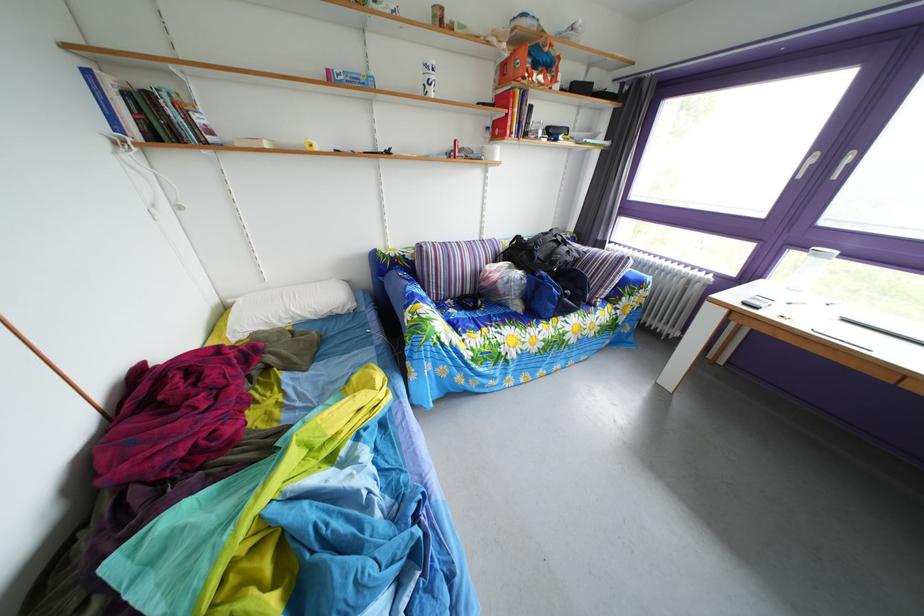
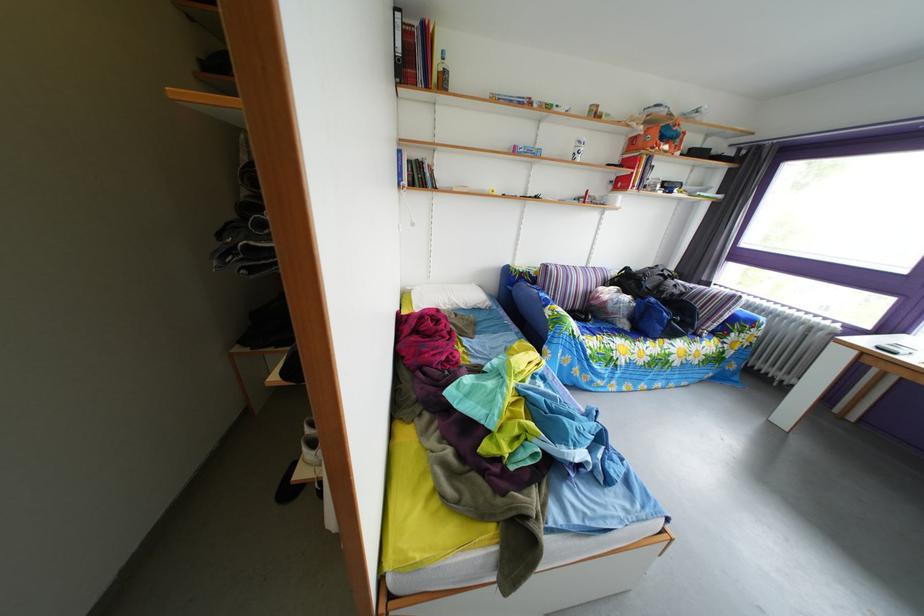
Find the pixel in the second image that matches the point at 545,74 in the first image.

(673, 147)